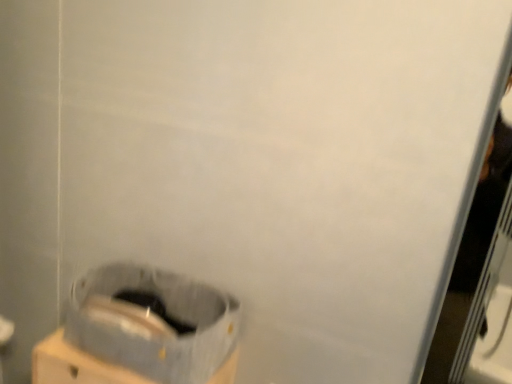
You are a GUI agent. You are given a task and a screenshot of the screen. Output one action in this format:
    pyautogui.click(x=<x>, y=<y>)
    Task: Click on the gray fabric bag at lower center
    Image resolution: width=512 pixels, height=384 pixels.
    Given the screenshot: What is the action you would take?
    pyautogui.click(x=76, y=365)

Describe the element at coordinates (76, 365) in the screenshot. This screenshot has height=384, width=512. I see `gray fabric bag at lower center` at that location.

The width and height of the screenshot is (512, 384). What do you see at coordinates (156, 339) in the screenshot?
I see `gray fabric waste container at lower left` at bounding box center [156, 339].

At what (x,y) coordinates should I click in order to perform the action: click on gray fabric waste container at lower left. Please return your answer as a coordinate pair (x, y). The image size is (512, 384). Looking at the image, I should click on (156, 339).

Locate an element on the screen. gray fabric bag at lower center is located at coordinates (76, 365).

Between gray fabric bag at lower center and gray fabric waste container at lower left, which one appears on the right side from the viewer's perspective?

From the viewer's perspective, gray fabric waste container at lower left appears more on the right side.

Is gray fabric bag at lower center positioned in front of gray fabric waste container at lower left?

No.

Consider the image. Which point is more distant from viewer, (x=106, y=381) or (x=217, y=345)?

Point (x=106, y=381)

From the image's perspective, is gray fabric bag at lower center located above or below gray fabric waste container at lower left?

Clearly, from the image's perspective, gray fabric bag at lower center is below gray fabric waste container at lower left.

From a real-world perspective, is gray fabric bag at lower center positioned under gray fabric waste container at lower left based on gravity?

Yes, from a real-world perspective, gray fabric bag at lower center is beneath gray fabric waste container at lower left.

Can you confirm if gray fabric bag at lower center is wider than gray fabric waste container at lower left?

Indeed, gray fabric bag at lower center has a greater width compared to gray fabric waste container at lower left.

Can you confirm if gray fabric bag at lower center is shorter than gray fabric waste container at lower left?

Incorrect, the height of gray fabric bag at lower center does not fall short of that of gray fabric waste container at lower left.

Does gray fabric bag at lower center have a larger size compared to gray fabric waste container at lower left?

Indeed, gray fabric bag at lower center has a larger size compared to gray fabric waste container at lower left.

Would you say gray fabric bag at lower center is outside gray fabric waste container at lower left?

gray fabric bag at lower center is positioned outside gray fabric waste container at lower left.

Are gray fabric bag at lower center and gray fabric waste container at lower left located far from each other?

No, there isn't a large distance between gray fabric bag at lower center and gray fabric waste container at lower left.

Is gray fabric bag at lower center aimed at gray fabric waste container at lower left?

No, gray fabric bag at lower center is not oriented towards gray fabric waste container at lower left.

Measure the distance from gray fabric bag at lower center to gray fabric waste container at lower left.

gray fabric bag at lower center is 2.96 inches away from gray fabric waste container at lower left.

The image size is (512, 384). I want to click on cardboard box behind the gray fabric waste container at lower left, so click(x=76, y=365).

Consider the image. Which is more to the left, gray fabric waste container at lower left or gray fabric bag at lower center?

Positioned to the left is gray fabric bag at lower center.

Considering the relative positions of gray fabric waste container at lower left and gray fabric bag at lower center in the image provided, is gray fabric waste container at lower left in front of gray fabric bag at lower center?

Yes, the depth of gray fabric waste container at lower left is less than that of gray fabric bag at lower center.

Which is behind, point (113, 273) or point (44, 377)?

Positioned behind is point (113, 273).

From the image's perspective, which is above, gray fabric waste container at lower left or gray fabric bag at lower center?

From the image's view, gray fabric waste container at lower left is above.

From a real-world perspective, is gray fabric waste container at lower left above or below gray fabric bag at lower center?

From a real-world perspective, gray fabric waste container at lower left is physically above gray fabric bag at lower center.

Considering the sizes of gray fabric waste container at lower left and gray fabric bag at lower center in the image, is gray fabric waste container at lower left wider or thinner than gray fabric bag at lower center?

In the image, gray fabric waste container at lower left appears to be more narrow than gray fabric bag at lower center.

Can you confirm if gray fabric waste container at lower left is taller than gray fabric bag at lower center?

No, gray fabric waste container at lower left is not taller than gray fabric bag at lower center.

Considering the relative sizes of gray fabric waste container at lower left and gray fabric bag at lower center in the image provided, is gray fabric waste container at lower left smaller than gray fabric bag at lower center?

Indeed, gray fabric waste container at lower left has a smaller size compared to gray fabric bag at lower center.

Based on the photo, is gray fabric bag at lower center completely or partially inside gray fabric waste container at lower left?

Definitely not — gray fabric bag at lower center is not inside gray fabric waste container at lower left.

Is gray fabric waste container at lower left in contact with gray fabric bag at lower center?

Indeed, gray fabric waste container at lower left and gray fabric bag at lower center are beside each other and touching.

Could you tell me if gray fabric waste container at lower left is turned towards gray fabric bag at lower center?

No, gray fabric waste container at lower left is not turned towards gray fabric bag at lower center.

The height and width of the screenshot is (384, 512). What are the coordinates of `cardboard box below the gray fabric waste container at lower left (from the image's perspective)` in the screenshot? It's located at (76, 365).

Identify the location of waste container above the gray fabric bag at lower center (from the image's perspective). (156, 339).

You are a GUI agent. You are given a task and a screenshot of the screen. Output one action in this format:
    pyautogui.click(x=<x>, y=<y>)
    Task: Click on the waste container on the right of the gray fabric bag at lower center
    The height and width of the screenshot is (384, 512).
    Given the screenshot: What is the action you would take?
    pyautogui.click(x=156, y=339)